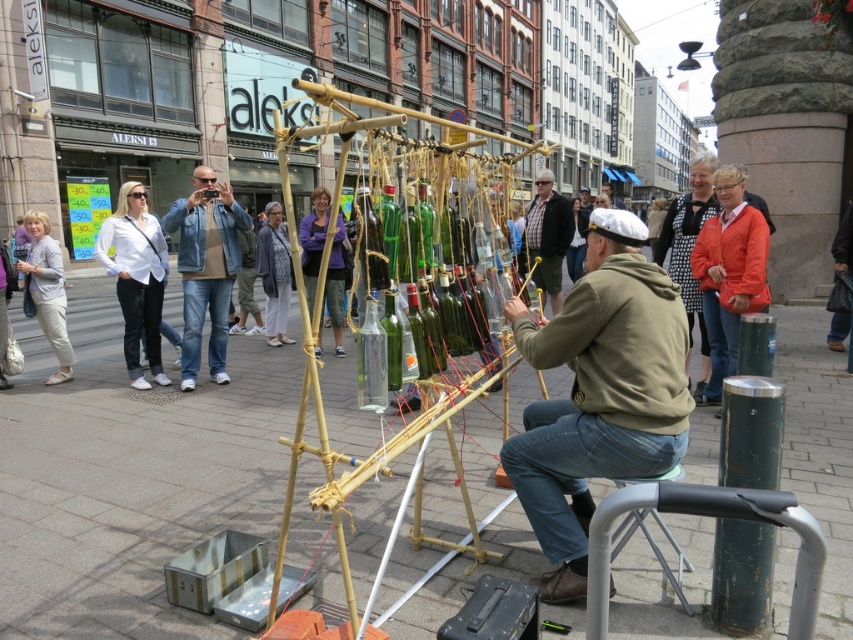
You are a photographer trying to capture the performer and his setup. You notice the light gray cotton pants at left and the purple fabric at center in your viewfinder. Which object should you focus on first if you want to include both in your shot without moving the camera?

The light gray cotton pants at left is below the purple fabric at center, so you should focus on the purple fabric at center first since it is higher up and will be in the foreground if you want both in frame.

You are a street performer who needs to place a new prop. You have a red box that must be placed between the smooth concrete pavement at center and the orange fabric jacket at upper right. Where should you position the red box?

The red box should be positioned to the left of the orange fabric jacket at upper right, as the smooth concrete pavement at center is already located to the left of the orange fabric jacket at upper right.

You are a photographer trying to capture the performer and the crowd. You notice two people in the scene wearing an orange fabric jacket at upper right and a light gray sweater at center. Which one is easier to include in your photo without cropping?

The orange fabric jacket at upper right is closer to the viewer than the light gray sweater at center, so it will appear larger and more prominent in the photo, making it easier to include without cropping.